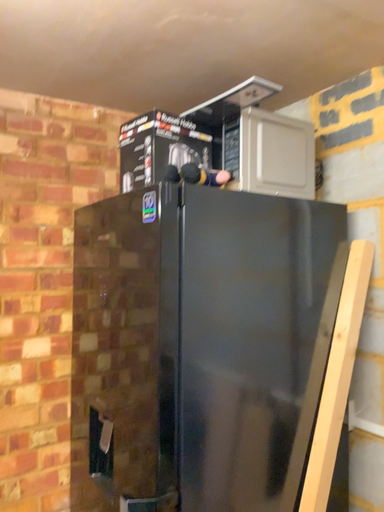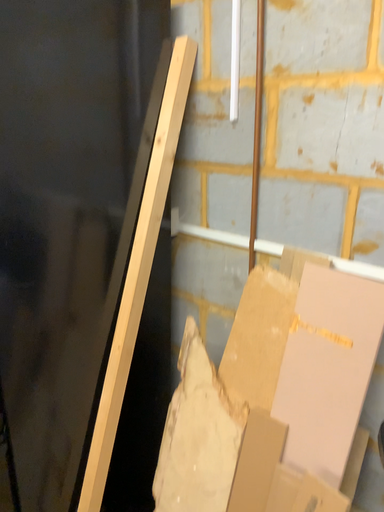
Question: Which way did the camera rotate in the video?

Choices:
 (A) rotated right
 (B) rotated left

Answer: (A)